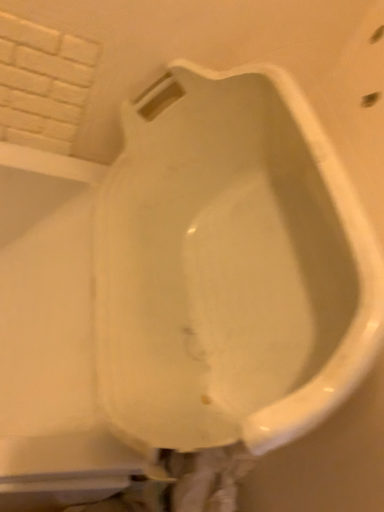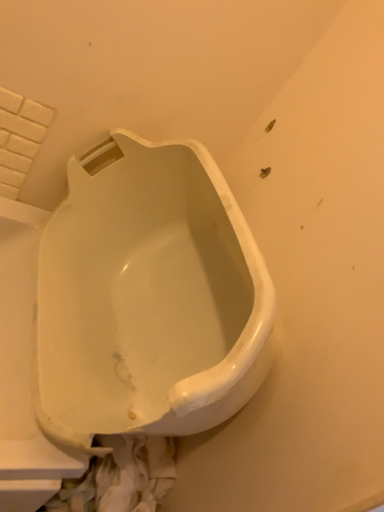
Question: Which way did the camera rotate in the video?

Choices:
 (A) rotated right
 (B) rotated left

Answer: (A)